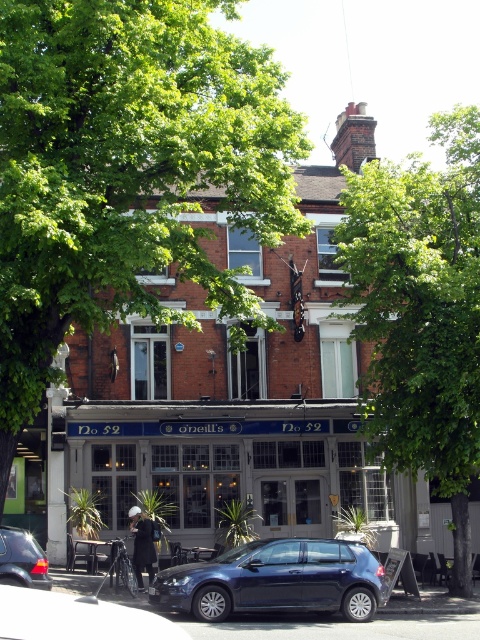
Question: Which point is closer to the camera?

Choices:
 (A) (14, 584)
 (B) (130, 509)

Answer: (A)

Question: In this image, where is green leafy tree at center located relative to dark blue jeans at center?

Choices:
 (A) right
 (B) left

Answer: (A)

Question: Is green leafy tree at upper left positioned in front of dark blue jeans at center?

Choices:
 (A) no
 (B) yes

Answer: (B)

Question: Which object is positioned farthest from the glossy metallic hatchback at lower center?

Choices:
 (A) metallic blue car at lower left
 (B) brick building at center
 (C) metallic blue hatchback at lower center

Answer: (B)

Question: Observing the image, what is the correct spatial positioning of metallic blue hatchback at lower center in reference to dark blue jeans at center?

Choices:
 (A) left
 (B) right

Answer: (B)

Question: Which point is farther to the camera?

Choices:
 (A) metallic blue hatchback at lower center
 (B) dark blue jeans at center
 (C) brick building at center

Answer: (B)